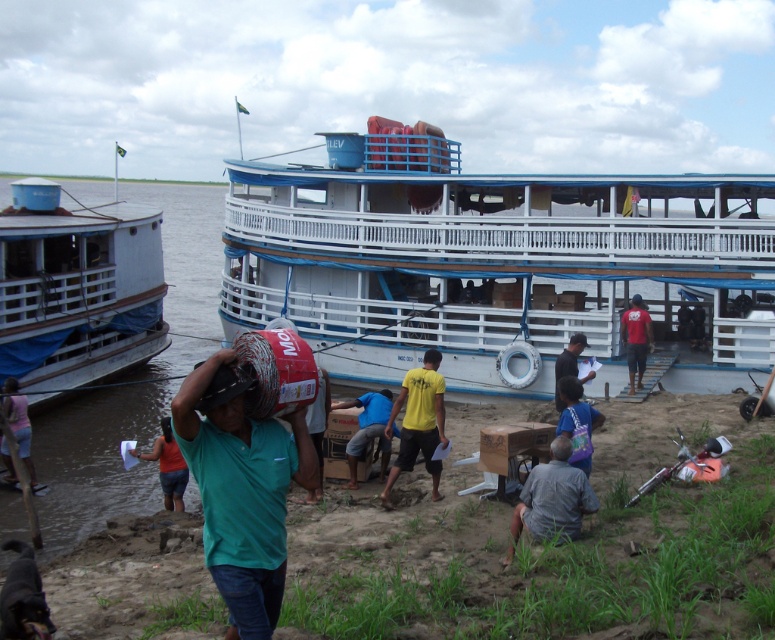
You are standing at the camera position and want to reach point [150,241]. Can you walk directly to that point without obstacles?

The distance between you and point [150,241] is 26.56 meters. Since there are no obstacles mentioned in the scene description, you can walk directly to that point.

You are a photographer trying to capture a photo of the blue tarpaulin boat at left and the blue fabric shirt at center. Since you want both subjects to appear equally large in the photo, which subject should you move closer to and which should you move farther away from the camera?

The blue tarpaulin boat at left is wider than the blue fabric shirt at center. To make both appear equally large in the photo, you should move the blue fabric shirt at center closer to the camera and move the blue tarpaulin boat at left farther away from the camera.